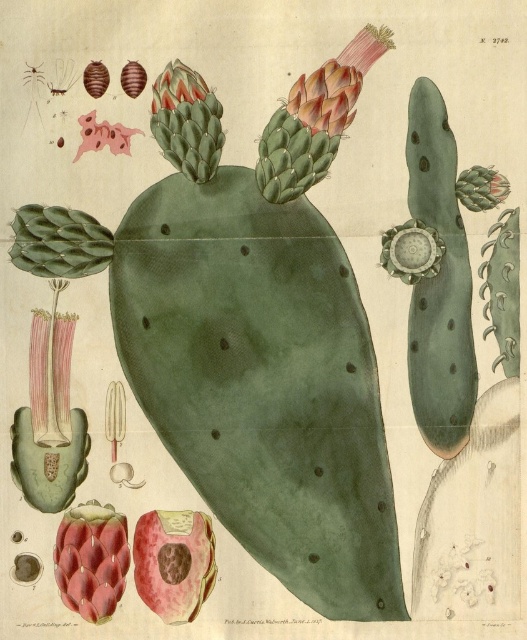
You are examining the cactus illustration and want to determine which of the two points, point (139,538) or point (168,152), is closer to you. Based on the illustration, which point is nearer?

Point (139,538) is closer to the camera than point (168,152), so it is the nearer point.

You are an artist sketching the cactus plant and need to place the pink matte flower at lower left in your drawing. According to the illustration, what are the coordinates where you should position it?

The pink matte flower at lower left should be positioned at coordinates point (92,560) as specified in the illustration.